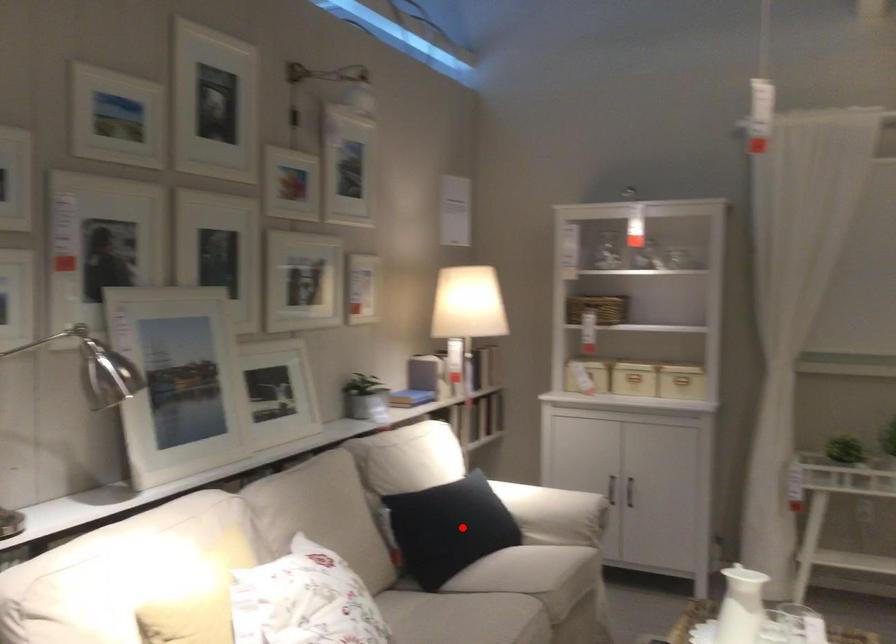
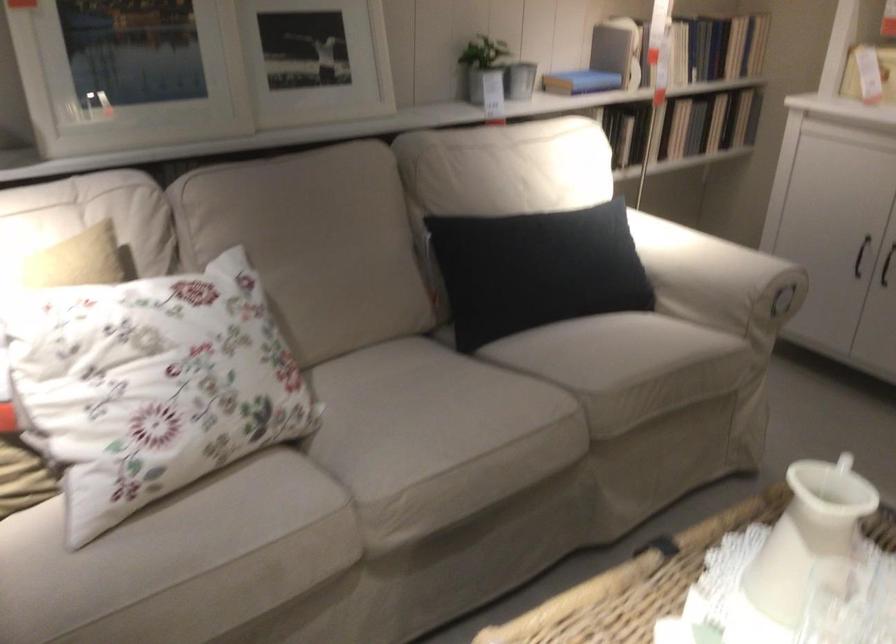
Where in the second image is the point corresponding to the highlighted location from the first image?

(536, 270)